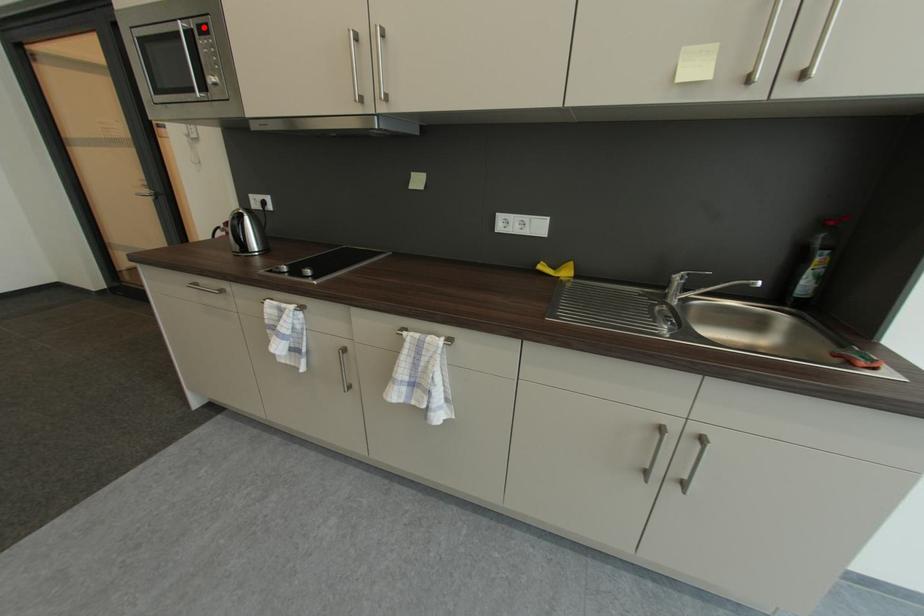
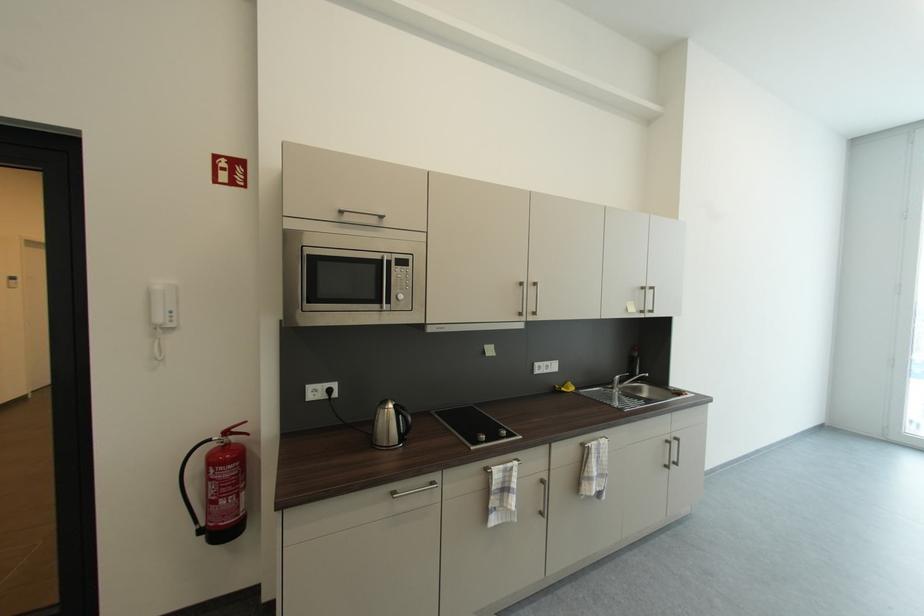
Question: I am providing you with two images of the same scene from different viewpoints. Image1 has a red point marked. In image2, the corresponding 3D location appears at what relative position? Reply with the corresponding letter.

Choices:
 (A) Closer
 (B) Farther

Answer: (A)